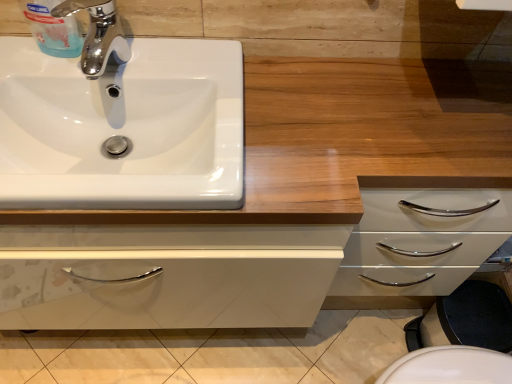
Question: Is white glossy sink at upper left looking in the opposite direction of chrome/metallic faucet at upper left?

Choices:
 (A) yes
 (B) no

Answer: (B)

Question: From a real-world perspective, is white glossy sink at upper left beneath chrome/metallic faucet at upper left?

Choices:
 (A) no
 (B) yes

Answer: (B)

Question: Is white glossy sink at upper left outside of chrome/metallic faucet at upper left?

Choices:
 (A) no
 (B) yes

Answer: (B)

Question: Is white glossy sink at upper left further to the viewer compared to chrome/metallic faucet at upper left?

Choices:
 (A) yes
 (B) no

Answer: (B)

Question: Is white glossy sink at upper left wider than chrome/metallic faucet at upper left?

Choices:
 (A) yes
 (B) no

Answer: (A)

Question: Considering the positions of white glossy sink at upper left and chrome/metallic faucet at upper left in the image, is white glossy sink at upper left taller or shorter than chrome/metallic faucet at upper left?

Choices:
 (A) tall
 (B) short

Answer: (B)

Question: Is point (233, 152) positioned closer to the camera than point (84, 72)?

Choices:
 (A) closer
 (B) farther

Answer: (A)

Question: In terms of width, does white glossy sink at upper left look wider or thinner when compared to chrome/metallic faucet at upper left?

Choices:
 (A) wide
 (B) thin

Answer: (A)

Question: Based on their sizes in the image, would you say white glossy sink at upper left is bigger or smaller than chrome/metallic faucet at upper left?

Choices:
 (A) big
 (B) small

Answer: (A)

Question: From the image's perspective, relative to white glossy sink at upper left, is chrome/metallic faucet at upper left above or below?

Choices:
 (A) below
 (B) above

Answer: (B)

Question: Would you say chrome/metallic faucet at upper left is to the left or to the right of white glossy sink at upper left in the picture?

Choices:
 (A) left
 (B) right

Answer: (B)

Question: Is chrome/metallic faucet at upper left bigger or smaller than white glossy sink at upper left?

Choices:
 (A) small
 (B) big

Answer: (A)

Question: Looking at their shapes, would you say chrome/metallic faucet at upper left is wider or thinner than white glossy sink at upper left?

Choices:
 (A) wide
 (B) thin

Answer: (B)

Question: Is chrome/metallic faucet at upper left inside the boundaries of wooden counter at upper center, or outside?

Choices:
 (A) outside
 (B) inside

Answer: (A)

Question: Does point (116, 56) appear closer or farther from the camera than point (330, 67)?

Choices:
 (A) farther
 (B) closer

Answer: (B)